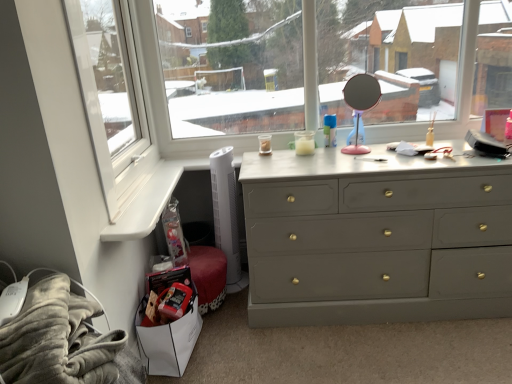
Question: Does matte gray dresser at center come behind pink plastic mirror at upper center?

Choices:
 (A) no
 (B) yes

Answer: (A)

Question: Does matte gray dresser at center have a lesser width compared to pink plastic mirror at upper center?

Choices:
 (A) no
 (B) yes

Answer: (A)

Question: Can you confirm if matte gray dresser at center is smaller than pink plastic mirror at upper center?

Choices:
 (A) yes
 (B) no

Answer: (B)

Question: From the image's perspective, would you say matte gray dresser at center is positioned over pink plastic mirror at upper center?

Choices:
 (A) no
 (B) yes

Answer: (A)

Question: From the image's perspective, is matte gray dresser at center beneath pink plastic mirror at upper center?

Choices:
 (A) yes
 (B) no

Answer: (A)

Question: Can you confirm if matte gray dresser at center is wider than pink plastic mirror at upper center?

Choices:
 (A) yes
 (B) no

Answer: (A)

Question: Is pink plastic mirror at upper center thinner than matte gray dresser at center?

Choices:
 (A) yes
 (B) no

Answer: (A)

Question: From a real-world perspective, is pink plastic mirror at upper center positioned under matte gray dresser at center based on gravity?

Choices:
 (A) yes
 (B) no

Answer: (B)

Question: Considering the relative sizes of pink plastic mirror at upper center and matte gray dresser at center in the image provided, is pink plastic mirror at upper center wider than matte gray dresser at center?

Choices:
 (A) yes
 (B) no

Answer: (B)

Question: Is pink plastic mirror at upper center facing away from matte gray dresser at center?

Choices:
 (A) yes
 (B) no

Answer: (B)

Question: From the image's perspective, is pink plastic mirror at upper center on matte gray dresser at center?

Choices:
 (A) yes
 (B) no

Answer: (A)

Question: Could matte gray dresser at center be considered to be inside pink plastic mirror at upper center?

Choices:
 (A) no
 (B) yes

Answer: (A)

Question: Can you confirm if matte gray dresser at center is thinner than fuzzy gray blanket at lower left?

Choices:
 (A) no
 (B) yes

Answer: (A)